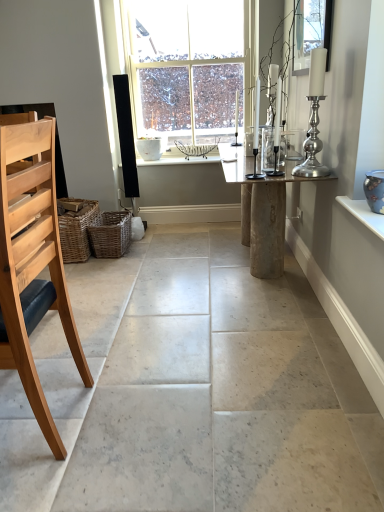
You are a GUI agent. You are given a task and a screenshot of the screen. Output one action in this format:
    pyautogui.click(x=<x>, y=<y>)
    Task: Click on the free space that is in between rustic wood table at center and woven brown basket at lower left, the 2th basket when ordered from left to right
    This screenshot has height=512, width=384.
    Given the screenshot: What is the action you would take?
    pyautogui.click(x=180, y=261)